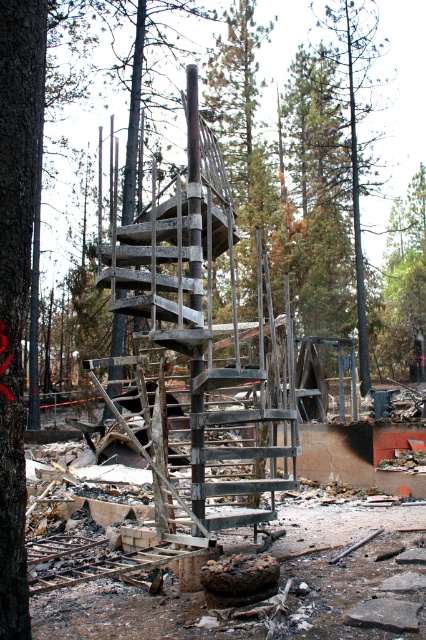
Does charred wood spiral staircase at center appear over green pine tree at center?

No, charred wood spiral staircase at center is not above green pine tree at center.

Does charred wood spiral staircase at center have a larger size compared to green pine tree at center?

Indeed, charred wood spiral staircase at center has a larger size compared to green pine tree at center.

This screenshot has width=426, height=640. Find the location of `charred wood spiral staircase at center`. charred wood spiral staircase at center is located at coordinates (210, 333).

Find the location of a particular element. charred wood spiral staircase at center is located at coordinates (210, 333).

Does dark brown bark tree at center have a lesser height compared to green pine tree at center?

Yes, dark brown bark tree at center is shorter than green pine tree at center.

Can you confirm if dark brown bark tree at center is smaller than green pine tree at center?

Yes.

Who is more forward, (x=26, y=93) or (x=365, y=346)?

Positioned in front is point (x=26, y=93).

The height and width of the screenshot is (640, 426). I want to click on dark brown bark tree at center, so click(16, 280).

Between point (284, 480) and point (20, 422), which one is positioned in front?

Point (20, 422) is more forward.

Does point (213, 173) lie behind point (8, 374)?

Yes, point (213, 173) is farther from viewer.

Find the location of `charred wood spiral staircase at center`. charred wood spiral staircase at center is located at coordinates (210, 333).